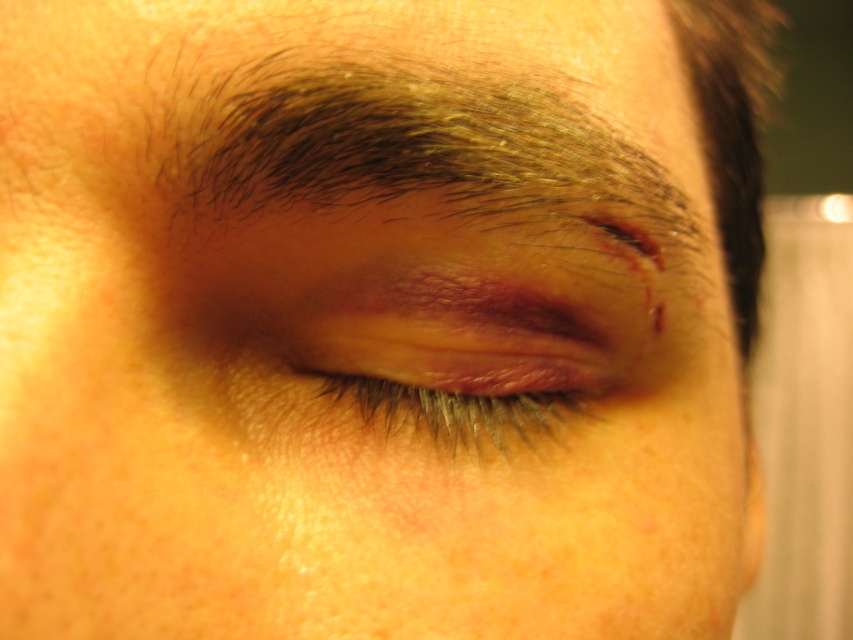
Can you confirm if dark brown hair at upper center is positioned above swollen skin at center?

Yes.

Is dark brown hair at upper center shorter than swollen skin at center?

No, dark brown hair at upper center is not shorter than swollen skin at center.

Is point (206, 161) more distant than point (546, 435)?

That is False.

Image resolution: width=853 pixels, height=640 pixels. What are the coordinates of `dark brown hair at upper center` in the screenshot? It's located at (412, 147).